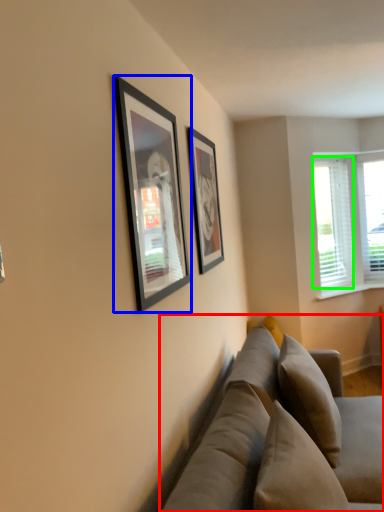
Question: Which object is the farthest from studio couch (highlighted by a red box)? Choose among these: picture frame (highlighted by a blue box) or window screen (highlighted by a green box).

Choices:
 (A) picture frame
 (B) window screen

Answer: (B)